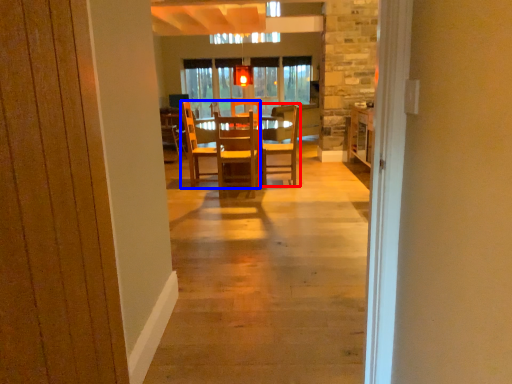
Question: Which object is further to the camera taking this photo, chair (highlighted by a red box) or chair (highlighted by a blue box)?

Choices:
 (A) chair
 (B) chair

Answer: (A)